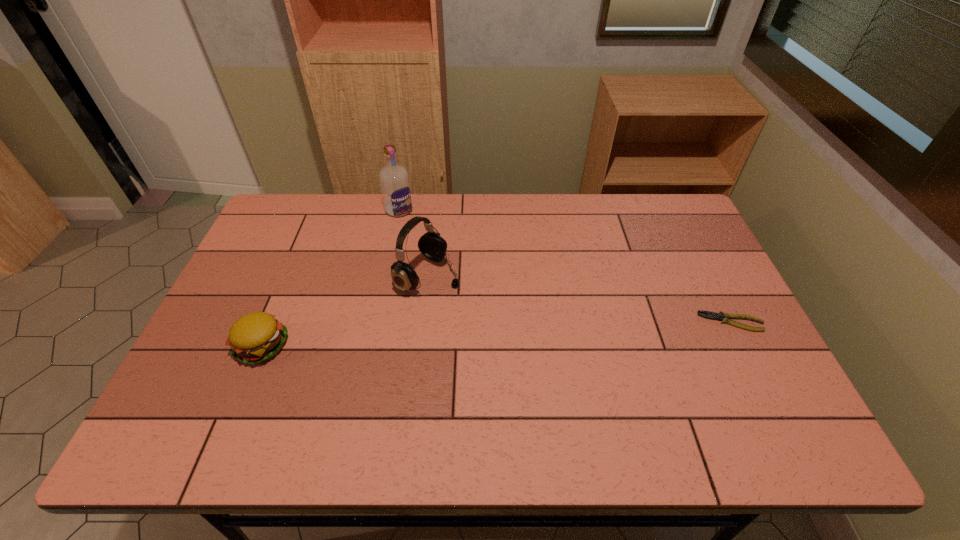
Find the location of a particular element. Image resolution: width=960 pixels, height=540 pixels. vacant space on the desktop that is between the leftmost object and the rightmost object and is positioned with the microphone on the side of the third shortest object is located at coordinates (551, 332).

Where is `free spot on the desktop that is between the hamburger and the rightmost object and is positioned on the label of the vodka`? free spot on the desktop that is between the hamburger and the rightmost object and is positioned on the label of the vodka is located at coordinates (508, 334).